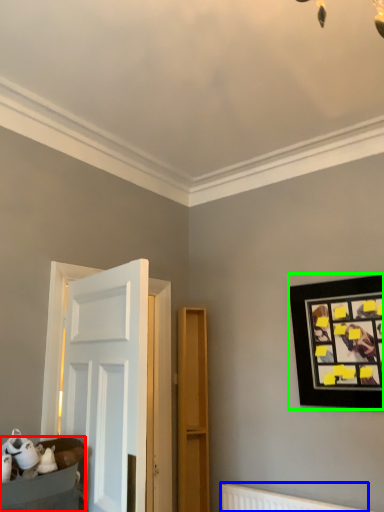
Question: Which object is positioned farthest from furniture (highlighted by a red box)? Select from radiator (highlighted by a blue box) and picture frame (highlighted by a green box).

Choices:
 (A) radiator
 (B) picture frame

Answer: (B)